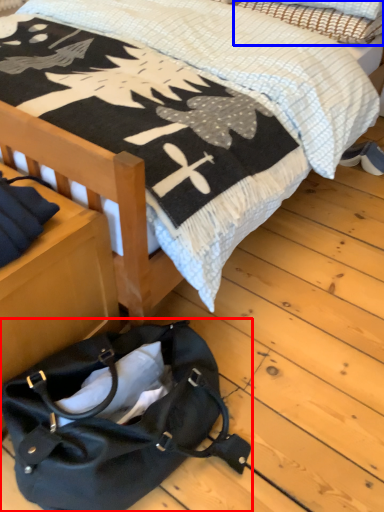
Question: Which object appears closest to the camera in this image, handbag (highlighted by a red box) or pillow (highlighted by a blue box)?

Choices:
 (A) handbag
 (B) pillow

Answer: (A)